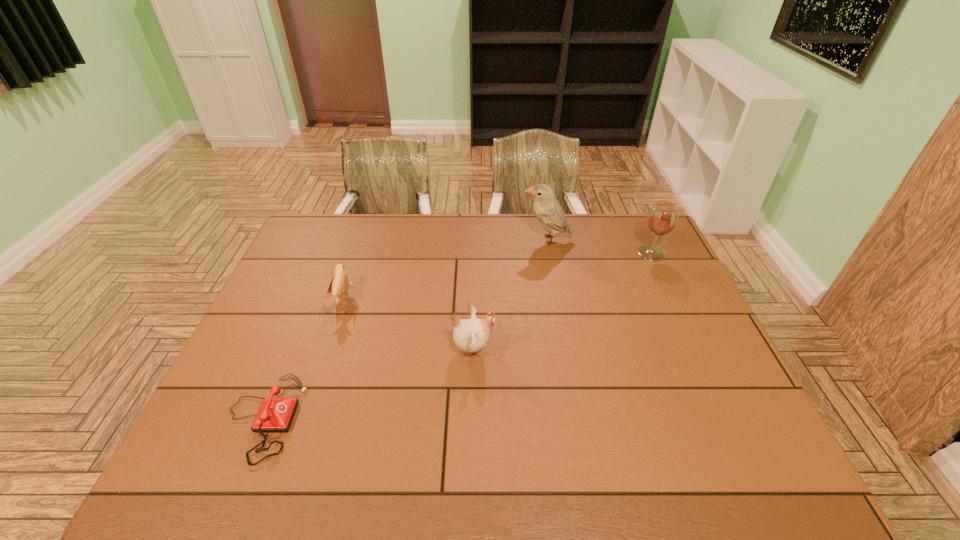
This screenshot has width=960, height=540. I want to click on blank region between the wineglass and the farthest bird, so click(x=599, y=246).

At what (x,y) coordinates should I click in order to perform the action: click on vacant space that's between the telephone and the fourth object from left to right. Please return your answer as a coordinate pair (x, y). Looking at the image, I should click on (405, 329).

I want to click on free area in between the third shortest object and the telephone, so click(x=368, y=384).

The width and height of the screenshot is (960, 540). What are the coordinates of `free space between the shortest object and the third object from right to left` in the screenshot? It's located at (368, 384).

Identify the location of unoccupied area between the second farthest bird and the second shortest bird. This screenshot has height=540, width=960. (407, 326).

Locate an element on the screen. The image size is (960, 540). free space between the third shortest object and the third nearest object is located at coordinates (407, 326).

The image size is (960, 540). I want to click on vacant area that lies between the second object from right to left and the shortest object, so click(x=405, y=329).

Identify the location of vacant area that lies between the second tallest object and the third object from left to right. This screenshot has height=540, width=960. (563, 301).

Find the location of a particular element. This screenshot has width=960, height=540. object that stands as the closest to the fourth shortest object is located at coordinates (548, 211).

Image resolution: width=960 pixels, height=540 pixels. I want to click on object that can be found as the fourth closest to the second tallest bird, so click(662, 217).